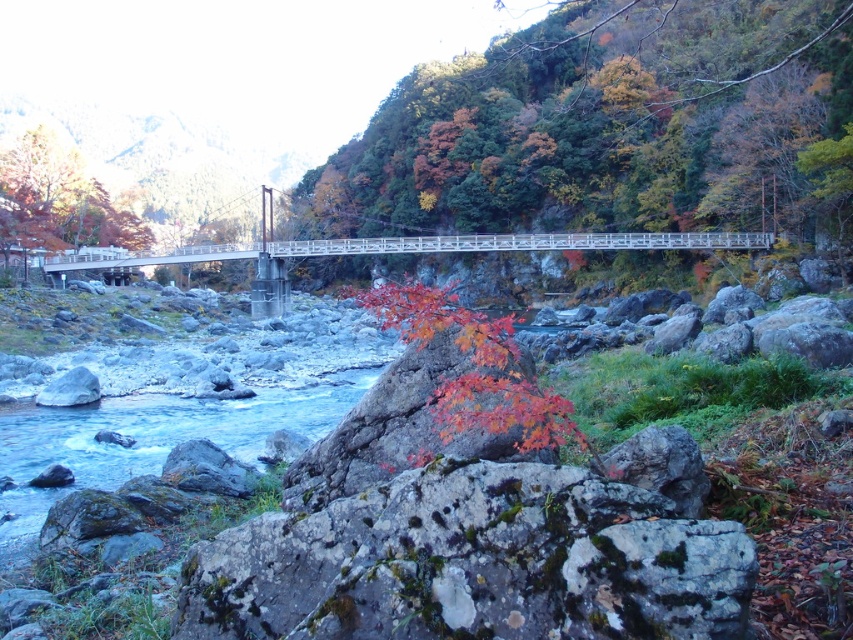
You are standing at the starting point of the white wooden bridge at center. If you walk straight ahead, will you reach the opposite bank before the bridge ends?

The white wooden bridge at center spans the entire river, so walking straight ahead will lead you to the opposite bank before the bridge ends.

You are a hiker carrying a backpack and need to cross the white wooden bridge at center. There is a mossy gray rock at center nearby. Which object is narrower in width?

The mossy gray rock at center is thinner than the white wooden bridge at center, so the mossy gray rock at center is narrower in width.